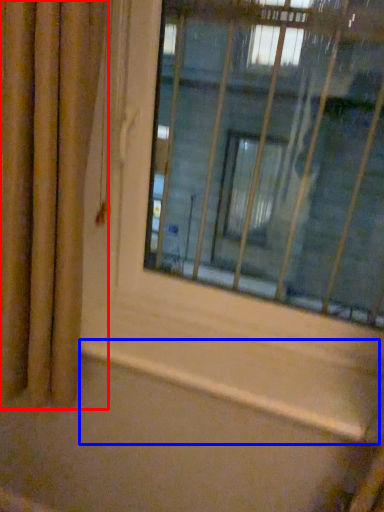
Question: Which object is closer to the camera taking this photo, curtain (highlighted by a red box) or window sill (highlighted by a blue box)?

Choices:
 (A) curtain
 (B) window sill

Answer: (A)